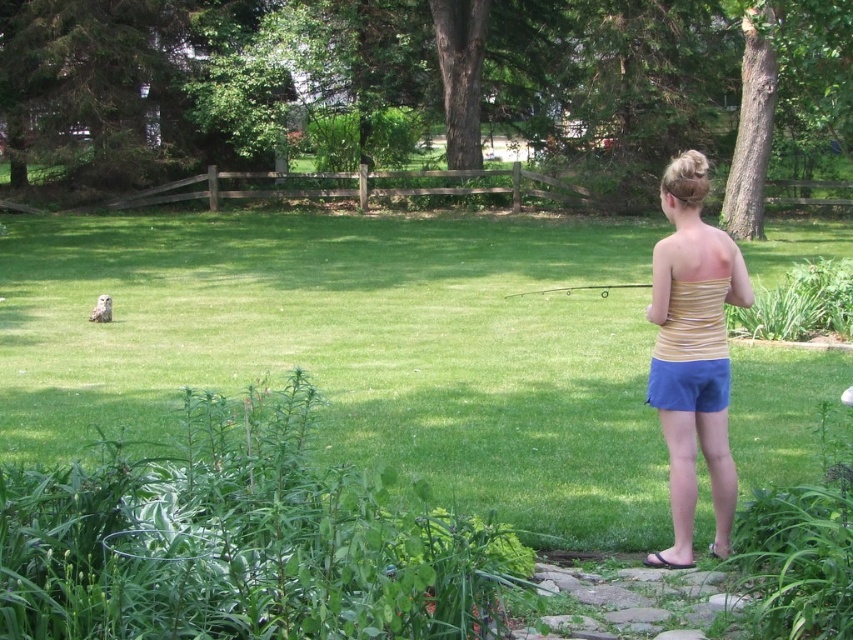
Question: Does green grass at center appear on the left side of yellow striped tank top at center?

Choices:
 (A) yes
 (B) no

Answer: (A)

Question: Is green grass at center wider than yellow striped tank top at center?

Choices:
 (A) no
 (B) yes

Answer: (B)

Question: Is green grass at center to the right of yellow striped tank top at center from the viewer's perspective?

Choices:
 (A) yes
 (B) no

Answer: (B)

Question: Which object appears farthest from the camera in this image?

Choices:
 (A) yellow striped tank top at center
 (B) green grass at center

Answer: (B)